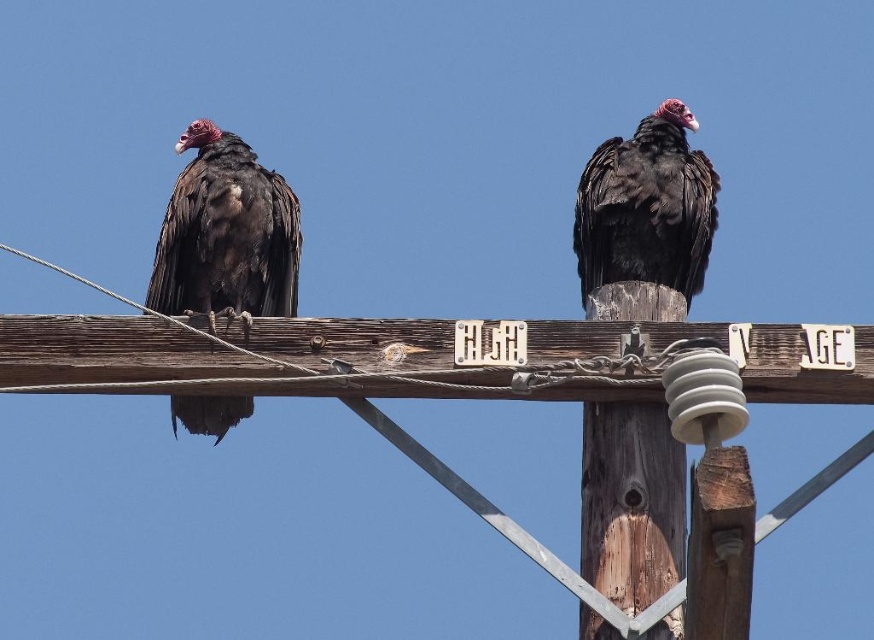
You are a birdwatcher observing the scene. You notice a matte black vulture at left. Where exactly is this vulture positioned on the utility pole?

The matte black vulture at left is located at point 0.369 along the horizontal axis and 0.260 along the vertical axis on the utility pole.